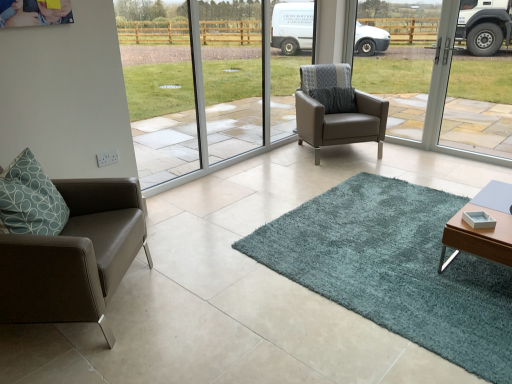
The image size is (512, 384). Find the location of `free region on the left part of wooden table at lower right`. free region on the left part of wooden table at lower right is located at coordinates (397, 271).